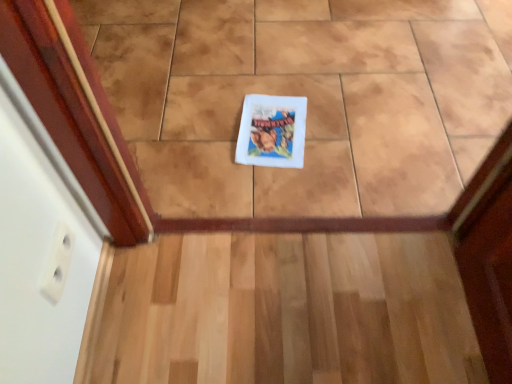
Question: From a real-world perspective, is white matte book cover at center positioned under light wood stairs at center based on gravity?

Choices:
 (A) no
 (B) yes

Answer: (A)

Question: Would you say white matte book cover at center is outside light wood stairs at center?

Choices:
 (A) no
 (B) yes

Answer: (B)

Question: Is white matte book cover at center taller than light wood stairs at center?

Choices:
 (A) no
 (B) yes

Answer: (B)

Question: Can you confirm if white matte book cover at center is positioned to the right of light wood stairs at center?

Choices:
 (A) yes
 (B) no

Answer: (B)

Question: Is white matte book cover at center not close to light wood stairs at center?

Choices:
 (A) yes
 (B) no

Answer: (B)

Question: Can you confirm if white matte book cover at center is smaller than light wood stairs at center?

Choices:
 (A) no
 (B) yes

Answer: (B)

Question: Is light wood stairs at center wider than white matte book cover at center?

Choices:
 (A) yes
 (B) no

Answer: (A)

Question: Is light wood stairs at center oriented away from white matte book cover at center?

Choices:
 (A) no
 (B) yes

Answer: (A)

Question: Is the depth of light wood stairs at center less than that of white matte book cover at center?

Choices:
 (A) yes
 (B) no

Answer: (A)

Question: Is light wood stairs at center not near white matte book cover at center?

Choices:
 (A) yes
 (B) no

Answer: (B)

Question: Is light wood stairs at center completely or partially outside of white matte book cover at center?

Choices:
 (A) no
 (B) yes

Answer: (B)

Question: Is light wood stairs at center placed right next to white matte book cover at center?

Choices:
 (A) no
 (B) yes

Answer: (A)

Question: Based on their positions, is light wood stairs at center located to the left or right of white matte book cover at center?

Choices:
 (A) left
 (B) right

Answer: (B)